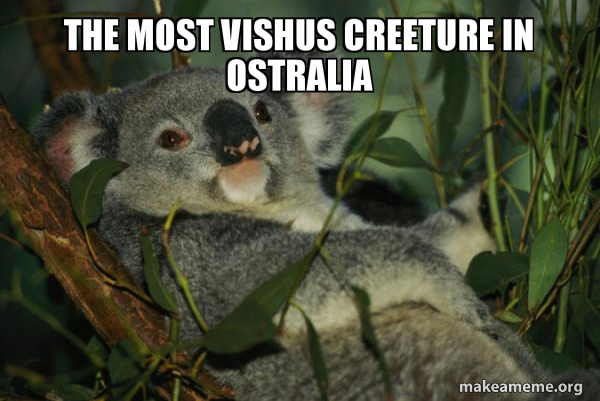
At what (x,y) coordinates should I click in order to perform the action: click on chest. Please return your answer as a coordinate pair (x, y). Looking at the image, I should click on (304, 218).